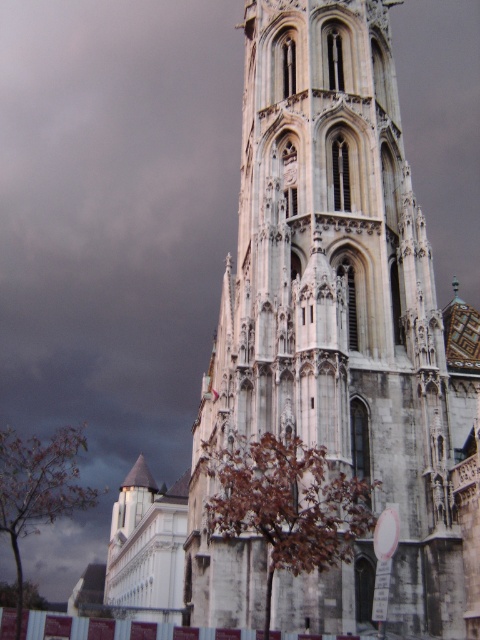
Question: Which point is closer to the camera?

Choices:
 (A) (265, 445)
 (B) (456, 372)
 (C) (19, 484)

Answer: (A)

Question: Can you confirm if brown leafy tree at lower center is positioned below brown leafy tree at lower left?

Choices:
 (A) yes
 (B) no

Answer: (B)

Question: Considering the real-world distances, which object is closest to the brown leafy tree at lower left?

Choices:
 (A) white stone tower at center
 (B) brown leafy tree at lower center

Answer: (B)

Question: Is the position of white stone tower at center less distant than that of brown leafy tree at lower center?

Choices:
 (A) yes
 (B) no

Answer: (B)

Question: Among these points, which one is farthest from the camera?

Choices:
 (A) (239, 356)
 (B) (278, 448)
 (C) (48, 504)

Answer: (C)

Question: Does white stone tower at center appear on the right side of brown leafy tree at lower left?

Choices:
 (A) yes
 (B) no

Answer: (A)